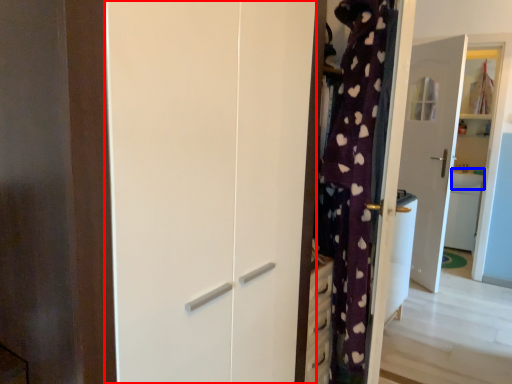
Question: Which object appears farthest to the camera in this image, screen door (highlighted by a red box) or counter top (highlighted by a blue box)?

Choices:
 (A) screen door
 (B) counter top

Answer: (B)